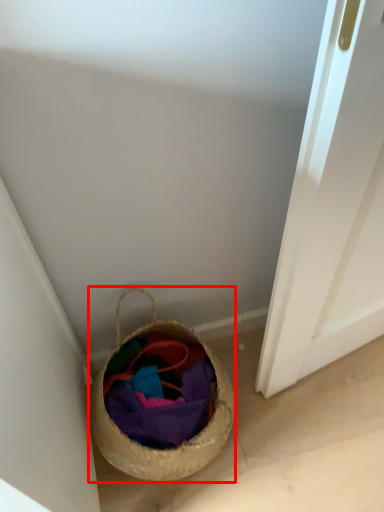
Question: From the image's perspective, considering the relative positions of basket (annotated by the red box) and fabric in the image provided, where is basket (annotated by the red box) located with respect to the staircase?

Choices:
 (A) below
 (B) above

Answer: (B)